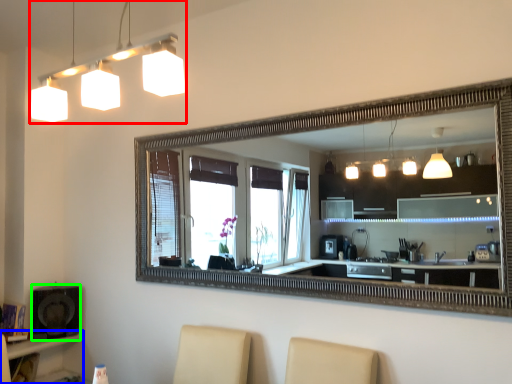
Question: Which object is the closest to the lamp (highlighted by a red box)? Choose among these: vanity (highlighted by a blue box) or speaker (highlighted by a green box).

Choices:
 (A) vanity
 (B) speaker

Answer: (B)